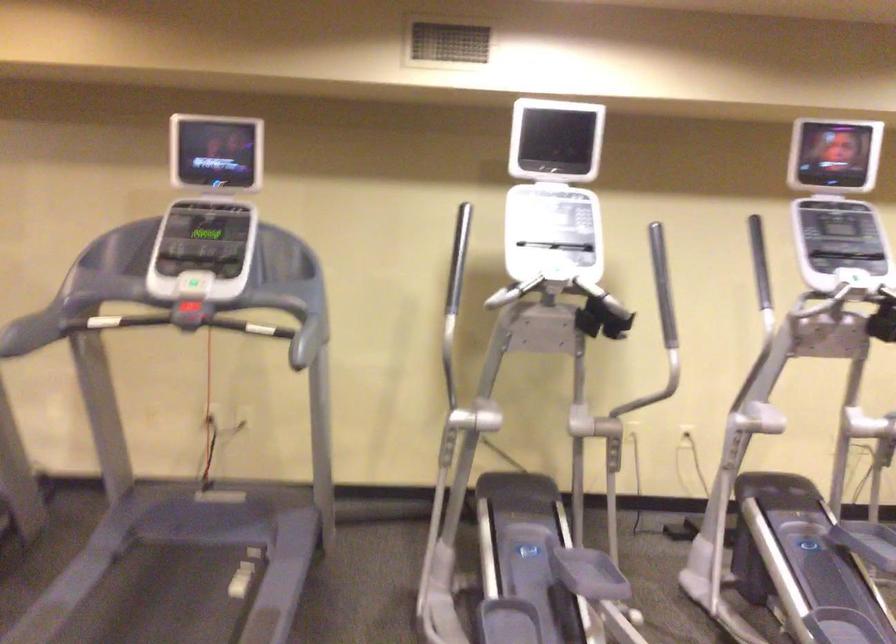
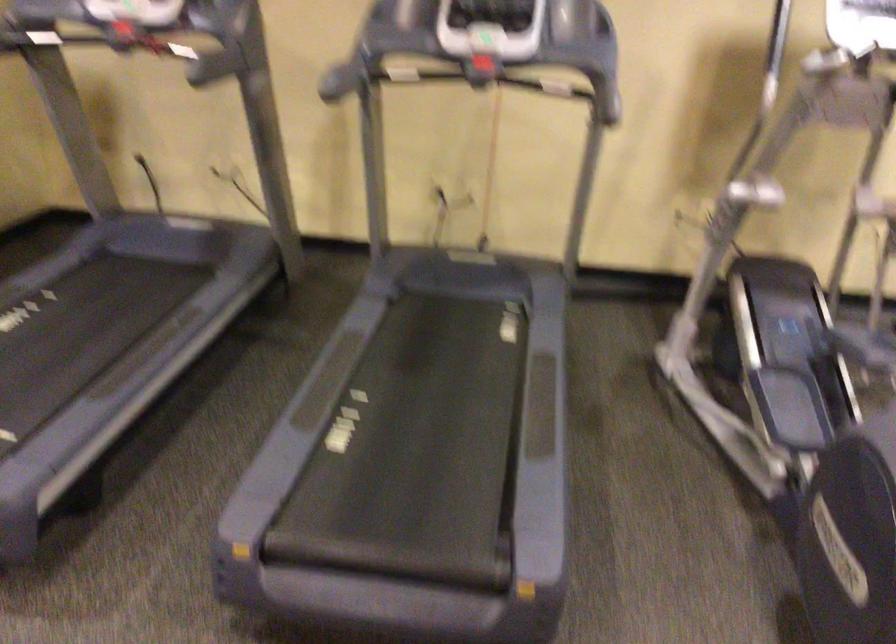
Question: The images are taken continuously from a first-person perspective. In which direction are you moving?

Choices:
 (A) Left
 (B) Right
 (C) Forward
 (D) Backward

Answer: (A)